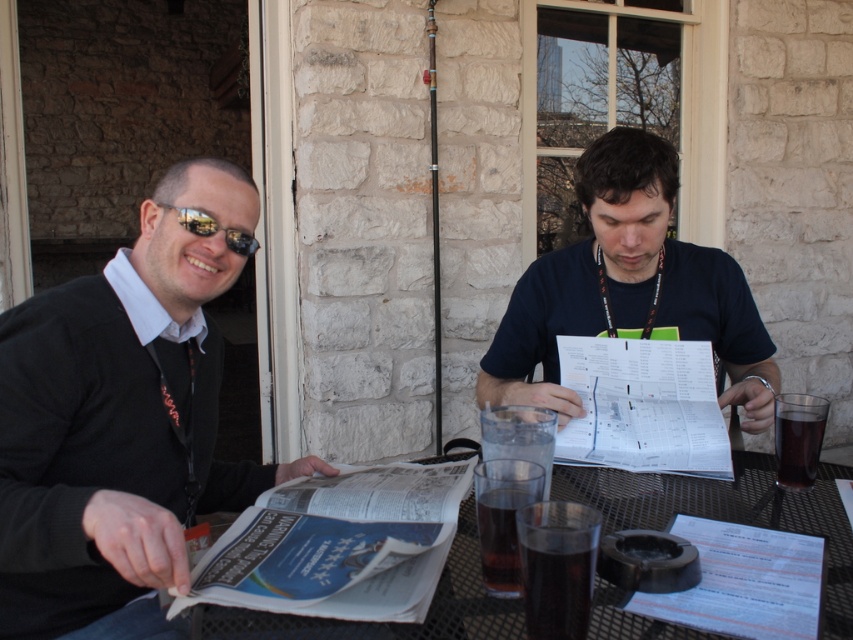
Can you confirm if metal mesh table at center is bigger than matte black sunglasses at upper left?

Correct, metal mesh table at center is larger in size than matte black sunglasses at upper left.

Is metal mesh table at center closer to camera compared to matte black sunglasses at upper left?

Yes, metal mesh table at center is closer to the viewer.

Who is more distant from viewer, (424,624) or (218,227)?

Point (218,227)

Find the location of `metal mesh table at center`. metal mesh table at center is located at coordinates (728, 512).

Does white paper at center have a smaller size compared to dark brown liquid at table center?

Incorrect, white paper at center is not smaller in size than dark brown liquid at table center.

This screenshot has height=640, width=853. What do you see at coordinates (643, 406) in the screenshot? I see `white paper at center` at bounding box center [643, 406].

Identify the location of white paper at center. (643, 406).

Between dark glass at table center and dark brown liquid at table center, which one appears on the left side from the viewer's perspective?

From the viewer's perspective, dark brown liquid at table center appears more on the left side.

Who is more forward, (575, 605) or (492, 508)?

Point (575, 605)

Where is `dark glass at table center`? The height and width of the screenshot is (640, 853). dark glass at table center is located at coordinates (556, 593).